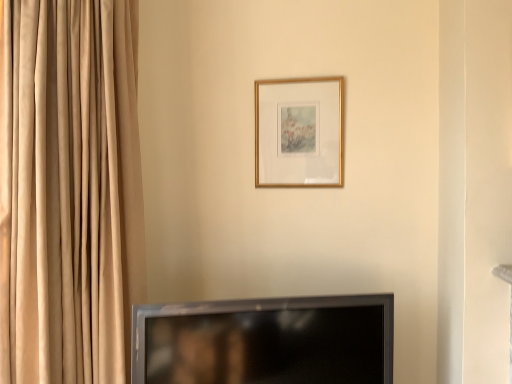
What do you see at coordinates (266, 341) in the screenshot?
I see `black glossy tv at lower center` at bounding box center [266, 341].

Locate an element on the screen. This screenshot has width=512, height=384. black glossy tv at lower center is located at coordinates (266, 341).

Looking at this image, measure the distance between black glossy tv at lower center and camera.

A distance of 1.37 meters exists between black glossy tv at lower center and camera.

The height and width of the screenshot is (384, 512). What do you see at coordinates (298, 132) in the screenshot?
I see `gold metallic picture frame at upper center` at bounding box center [298, 132].

The height and width of the screenshot is (384, 512). In order to click on gold metallic picture frame at upper center in this screenshot , I will do `click(298, 132)`.

Where is `black glossy tv at lower center`? This screenshot has width=512, height=384. black glossy tv at lower center is located at coordinates (266, 341).

Which is more to the left, black glossy tv at lower center or gold metallic picture frame at upper center?

black glossy tv at lower center is more to the left.

Is black glossy tv at lower center positioned behind gold metallic picture frame at upper center?

No, black glossy tv at lower center is closer to the viewer.

Does point (153, 356) come farther from viewer compared to point (256, 177)?

No, (153, 356) is closer to viewer.

From the image's perspective, between black glossy tv at lower center and gold metallic picture frame at upper center, which one is located above?

gold metallic picture frame at upper center.

From a real-world perspective, which is physically above, black glossy tv at lower center or gold metallic picture frame at upper center?

From a 3D spatial view, gold metallic picture frame at upper center is above.

Which of these two, black glossy tv at lower center or gold metallic picture frame at upper center, is wider?

black glossy tv at lower center is wider.

Who is taller, black glossy tv at lower center or gold metallic picture frame at upper center?

With more height is gold metallic picture frame at upper center.

Does black glossy tv at lower center have a larger size compared to gold metallic picture frame at upper center?

Yes, black glossy tv at lower center is bigger than gold metallic picture frame at upper center.

Is gold metallic picture frame at upper center located within black glossy tv at lower center?

No, gold metallic picture frame at upper center is not surrounded by black glossy tv at lower center.

Is black glossy tv at lower center far from gold metallic picture frame at upper center?

No.

Could you tell me if black glossy tv at lower center is turned towards gold metallic picture frame at upper center?

No, black glossy tv at lower center is not aimed at gold metallic picture frame at upper center.

Measure the distance from black glossy tv at lower center to gold metallic picture frame at upper center.

The distance of black glossy tv at lower center from gold metallic picture frame at upper center is 29.39 inches.

Where is `television beneath the gold metallic picture frame at upper center (from a real-world perspective)`? television beneath the gold metallic picture frame at upper center (from a real-world perspective) is located at coordinates (266, 341).

Looking at this image, which is more to the left, gold metallic picture frame at upper center or black glossy tv at lower center?

From the viewer's perspective, black glossy tv at lower center appears more on the left side.

Does gold metallic picture frame at upper center come behind black glossy tv at lower center?

That is True.

Which point is more forward, [320,85] or [382,362]?

Positioned in front is point [382,362].

From the image's perspective, is gold metallic picture frame at upper center under black glossy tv at lower center?

No.

From a real-world perspective, is gold metallic picture frame at upper center positioned under black glossy tv at lower center based on gravity?

Incorrect, from a real-world perspective, gold metallic picture frame at upper center is higher than black glossy tv at lower center.

Considering the sizes of gold metallic picture frame at upper center and black glossy tv at lower center in the image, is gold metallic picture frame at upper center wider or thinner than black glossy tv at lower center?

In the image, gold metallic picture frame at upper center appears to be more narrow than black glossy tv at lower center.

Who is shorter, gold metallic picture frame at upper center or black glossy tv at lower center?

black glossy tv at lower center is shorter.

Does gold metallic picture frame at upper center have a smaller size compared to black glossy tv at lower center?

Yes.

Could black glossy tv at lower center be considered to be inside gold metallic picture frame at upper center?

No, black glossy tv at lower center is not inside gold metallic picture frame at upper center.

Is gold metallic picture frame at upper center positioned far away from black glossy tv at lower center?

Actually, gold metallic picture frame at upper center and black glossy tv at lower center are a little close together.

Could you tell me if gold metallic picture frame at upper center is facing black glossy tv at lower center?

No, gold metallic picture frame at upper center is not facing towards black glossy tv at lower center.

How many degrees apart are the facing directions of gold metallic picture frame at upper center and black glossy tv at lower center?

gold metallic picture frame at upper center and black glossy tv at lower center are facing 22.1 degrees away from each other.

Find the location of `picture frame on the right of black glossy tv at lower center`. picture frame on the right of black glossy tv at lower center is located at coordinates (298, 132).

This screenshot has width=512, height=384. I want to click on picture frame lying on the right of black glossy tv at lower center, so click(x=298, y=132).

In the image, there is a gold metallic picture frame at upper center. Where is `television below it (from the image's perspective)`? The width and height of the screenshot is (512, 384). television below it (from the image's perspective) is located at coordinates (266, 341).